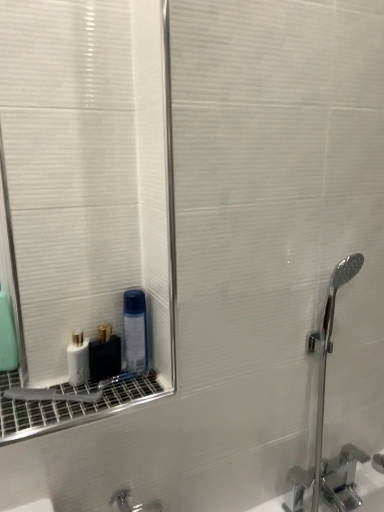
What do you see at coordinates (323, 417) in the screenshot? This screenshot has width=384, height=512. I see `chrome metallic faucet at right` at bounding box center [323, 417].

Where is `white glossy bottle at lower left, placed as the third mouthwash when sorted from right to left`? white glossy bottle at lower left, placed as the third mouthwash when sorted from right to left is located at coordinates (78, 359).

This screenshot has height=512, width=384. What do you see at coordinates (7, 335) in the screenshot?
I see `green matte mouthwash at left, arranged as the 4th mouthwash when viewed from the right` at bounding box center [7, 335].

Locate an element on the screen. Image resolution: width=384 pixels, height=512 pixels. chrome metallic faucet at right is located at coordinates tap(323, 417).

Who is taller, white glossy bottle at lower left, the second mouthwash from the left, or green matte mouthwash at left, arranged as the 4th mouthwash when viewed from the right?

green matte mouthwash at left, arranged as the 4th mouthwash when viewed from the right.

I want to click on mouthwash that is the 1st object to the right of the green matte mouthwash at left, arranged as the 4th mouthwash when viewed from the right, starting at the anchor, so coord(78,359).

Does white glossy bottle at lower left, placed as the third mouthwash when sorted from right to left, touch green matte mouthwash at left, arranged as the 4th mouthwash when viewed from the right?

No, white glossy bottle at lower left, placed as the third mouthwash when sorted from right to left, is not making contact with green matte mouthwash at left, arranged as the 4th mouthwash when viewed from the right.

Considering the sizes of objects white glossy bottle at lower left, placed as the third mouthwash when sorted from right to left, and green matte mouthwash at left, the 1th mouthwash viewed from the left, in the image provided, who is wider, white glossy bottle at lower left, placed as the third mouthwash when sorted from right to left, or green matte mouthwash at left, the 1th mouthwash viewed from the left,?

white glossy bottle at lower left, placed as the third mouthwash when sorted from right to left, is wider.

Does green matte mouthwash at left, arranged as the 4th mouthwash when viewed from the right, contain white glossy bottle at lower left, which appears as the 3th mouthwash when viewed from the left?

No, green matte mouthwash at left, arranged as the 4th mouthwash when viewed from the right, does not contain white glossy bottle at lower left, which appears as the 3th mouthwash when viewed from the left.

Who is smaller, green matte mouthwash at left, arranged as the 4th mouthwash when viewed from the right, or white glossy bottle at lower left, which is the second mouthwash from right to left?

white glossy bottle at lower left, which is the second mouthwash from right to left.

Would you say green matte mouthwash at left, the 1th mouthwash viewed from the left, is a long distance from white glossy bottle at lower left, which appears as the 3th mouthwash when viewed from the left?

No, green matte mouthwash at left, the 1th mouthwash viewed from the left, is in close proximity to white glossy bottle at lower left, which appears as the 3th mouthwash when viewed from the left.

Considering their positions, is green matte mouthwash at left, the 1th mouthwash viewed from the left, located in front of or behind white glossy bottle at lower left, which appears as the 3th mouthwash when viewed from the left?

In the image, green matte mouthwash at left, the 1th mouthwash viewed from the left, appears behind white glossy bottle at lower left, which appears as the 3th mouthwash when viewed from the left.

Between green matte mouthwash at left, arranged as the 4th mouthwash when viewed from the right, and transparent plastic mouthwash at lower left, the first mouthwash from the right, which one appears on the right side from the viewer's perspective?

From the viewer's perspective, transparent plastic mouthwash at lower left, the first mouthwash from the right, appears more on the right side.

How different are the orientations of green matte mouthwash at left, arranged as the 4th mouthwash when viewed from the right, and transparent plastic mouthwash at lower left, the first mouthwash from the right, in degrees?

22.5 degrees separate the facing orientations of green matte mouthwash at left, arranged as the 4th mouthwash when viewed from the right, and transparent plastic mouthwash at lower left, the first mouthwash from the right.

Do you think green matte mouthwash at left, the 1th mouthwash viewed from the left, is within transparent plastic mouthwash at lower left, the first mouthwash from the right, or outside of it?

green matte mouthwash at left, the 1th mouthwash viewed from the left, exists outside the volume of transparent plastic mouthwash at lower left, the first mouthwash from the right.

Between point (5, 359) and point (143, 328), which one is positioned in front?

The point (143, 328) is closer.

Looking at this image, is white glossy bottle at lower left, which appears as the 3th mouthwash when viewed from the left, looking in the opposite direction of green matte mouthwash at left, the 1th mouthwash viewed from the left?

That's not correct — white glossy bottle at lower left, which appears as the 3th mouthwash when viewed from the left, is not looking away from green matte mouthwash at left, the 1th mouthwash viewed from the left.

Is white glossy bottle at lower left, which is the second mouthwash from right to left, behind green matte mouthwash at left, the 1th mouthwash viewed from the left?

No, the depth of white glossy bottle at lower left, which is the second mouthwash from right to left, is less than that of green matte mouthwash at left, the 1th mouthwash viewed from the left.

Which is in front, point (98, 355) or point (5, 346)?

Positioned in front is point (98, 355).

Who is shorter, white glossy bottle at lower left, which appears as the 3th mouthwash when viewed from the left, or green matte mouthwash at left, the 1th mouthwash viewed from the left?

white glossy bottle at lower left, which appears as the 3th mouthwash when viewed from the left, is shorter.

From a real-world perspective, is green matte mouthwash at left, arranged as the 4th mouthwash when viewed from the right, above or below white glossy bottle at lower left, the second mouthwash from the left?

In terms of real-world spatial position, green matte mouthwash at left, arranged as the 4th mouthwash when viewed from the right, is above white glossy bottle at lower left, the second mouthwash from the left.

Would you say green matte mouthwash at left, arranged as the 4th mouthwash when viewed from the right, is inside or outside white glossy bottle at lower left, placed as the third mouthwash when sorted from right to left?

green matte mouthwash at left, arranged as the 4th mouthwash when viewed from the right, is not inside white glossy bottle at lower left, placed as the third mouthwash when sorted from right to left, it's outside.

Considering the relative sizes of green matte mouthwash at left, arranged as the 4th mouthwash when viewed from the right, and white glossy bottle at lower left, the second mouthwash from the left, in the image provided, is green matte mouthwash at left, arranged as the 4th mouthwash when viewed from the right, taller than white glossy bottle at lower left, the second mouthwash from the left,?

Yes, green matte mouthwash at left, arranged as the 4th mouthwash when viewed from the right, is taller than white glossy bottle at lower left, the second mouthwash from the left.

From a real-world perspective, which mouthwash is the 3rd one above the white glossy bottle at lower left, the second mouthwash from the left? Please provide its 2D coordinates.

[(7, 335)]

Is chrome metallic faucet at right inside white glossy bottle at lower left, the second mouthwash from the left?

Definitely not — chrome metallic faucet at right is not inside white glossy bottle at lower left, the second mouthwash from the left.

Which object is thinner, white glossy bottle at lower left, the second mouthwash from the left, or chrome metallic faucet at right?

Thinner between the two is white glossy bottle at lower left, the second mouthwash from the left.

Can you confirm if white glossy bottle at lower left, the second mouthwash from the left, is shorter than chrome metallic faucet at right?

Yes.

Does point (88, 343) appear closer or farther from the camera than point (330, 313)?

Clearly, point (88, 343) is closer to the camera than point (330, 313).

Is transparent plastic mouthwash at lower left, the first mouthwash from the right, smaller than white glossy bottle at lower left, which appears as the 3th mouthwash when viewed from the left?

Incorrect, transparent plastic mouthwash at lower left, the first mouthwash from the right, is not smaller in size than white glossy bottle at lower left, which appears as the 3th mouthwash when viewed from the left.

Considering the positions of point (130, 368) and point (100, 328), is point (130, 368) closer or farther from the camera than point (100, 328)?

Point (130, 368) appears to be closer to the viewer than point (100, 328).

Locate an element on the screen. This screenshot has width=384, height=512. the 3rd mouthwash positioned below the green matte mouthwash at left, arranged as the 4th mouthwash when viewed from the right (from a real-world perspective) is located at coordinates (78, 359).

Where is `the 2nd mouthwash behind the white glossy bottle at lower left, which appears as the 3th mouthwash when viewed from the left`? Image resolution: width=384 pixels, height=512 pixels. the 2nd mouthwash behind the white glossy bottle at lower left, which appears as the 3th mouthwash when viewed from the left is located at coordinates (7, 335).

Based on their spatial positions, is green matte mouthwash at left, the 1th mouthwash viewed from the left, or transparent plastic mouthwash at lower left, the first mouthwash from the right, further from chrome metallic faucet at right?

green matte mouthwash at left, the 1th mouthwash viewed from the left, is further to chrome metallic faucet at right.

From the image, which object appears to be farther from transparent plastic mouthwash at lower left, which ranks as the fourth mouthwash in left-to-right order, green matte mouthwash at left, arranged as the 4th mouthwash when viewed from the right, or chrome metallic faucet at right?

Among the two, chrome metallic faucet at right is located further to transparent plastic mouthwash at lower left, which ranks as the fourth mouthwash in left-to-right order.

Based on their spatial positions, is white glossy bottle at lower left, which appears as the 3th mouthwash when viewed from the left, or chrome metallic faucet at right closer to transparent plastic mouthwash at lower left, which ranks as the fourth mouthwash in left-to-right order?

white glossy bottle at lower left, which appears as the 3th mouthwash when viewed from the left, is positioned closer to the anchor transparent plastic mouthwash at lower left, which ranks as the fourth mouthwash in left-to-right order.

Based on their spatial positions, is white glossy bottle at lower left, which appears as the 3th mouthwash when viewed from the left, or green matte mouthwash at left, arranged as the 4th mouthwash when viewed from the right, closer to chrome metallic faucet at right?

Based on the image, white glossy bottle at lower left, which appears as the 3th mouthwash when viewed from the left, appears to be nearer to chrome metallic faucet at right.

Considering their positions, is chrome metallic faucet at right positioned further to transparent plastic mouthwash at lower left, which ranks as the fourth mouthwash in left-to-right order, than green matte mouthwash at left, the 1th mouthwash viewed from the left?

Based on the image, chrome metallic faucet at right appears to be further to transparent plastic mouthwash at lower left, which ranks as the fourth mouthwash in left-to-right order.

When comparing their distances from transparent plastic mouthwash at lower left, the first mouthwash from the right, does green matte mouthwash at left, the 1th mouthwash viewed from the left, or white glossy bottle at lower left, which appears as the 3th mouthwash when viewed from the left, seem closer?

white glossy bottle at lower left, which appears as the 3th mouthwash when viewed from the left, lies closer to transparent plastic mouthwash at lower left, the first mouthwash from the right, than the other object.

Which object lies nearer to the anchor point transparent plastic mouthwash at lower left, the first mouthwash from the right, white glossy bottle at lower left, which is the second mouthwash from right to left, or green matte mouthwash at left, arranged as the 4th mouthwash when viewed from the right?

Based on the image, white glossy bottle at lower left, which is the second mouthwash from right to left, appears to be nearer to transparent plastic mouthwash at lower left, the first mouthwash from the right.

Looking at the image, which one is located closer to chrome metallic faucet at right, transparent plastic mouthwash at lower left, which ranks as the fourth mouthwash in left-to-right order, or white glossy bottle at lower left, the second mouthwash from the left?

The object closer to chrome metallic faucet at right is transparent plastic mouthwash at lower left, which ranks as the fourth mouthwash in left-to-right order.

Find the location of a particular element. This screenshot has width=384, height=512. mouthwash between green matte mouthwash at left, the 1th mouthwash viewed from the left, and white glossy bottle at lower left, which appears as the 3th mouthwash when viewed from the left, from left to right is located at coordinates (78, 359).

I want to click on mouthwash between white glossy bottle at lower left, which appears as the 3th mouthwash when viewed from the left, and chrome metallic faucet at right, in the horizontal direction, so click(135, 331).

Where is `mouthwash between white glossy bottle at lower left, the second mouthwash from the left, and transparent plastic mouthwash at lower left, the first mouthwash from the right, in the horizontal direction`? Image resolution: width=384 pixels, height=512 pixels. mouthwash between white glossy bottle at lower left, the second mouthwash from the left, and transparent plastic mouthwash at lower left, the first mouthwash from the right, in the horizontal direction is located at coordinates 104,354.